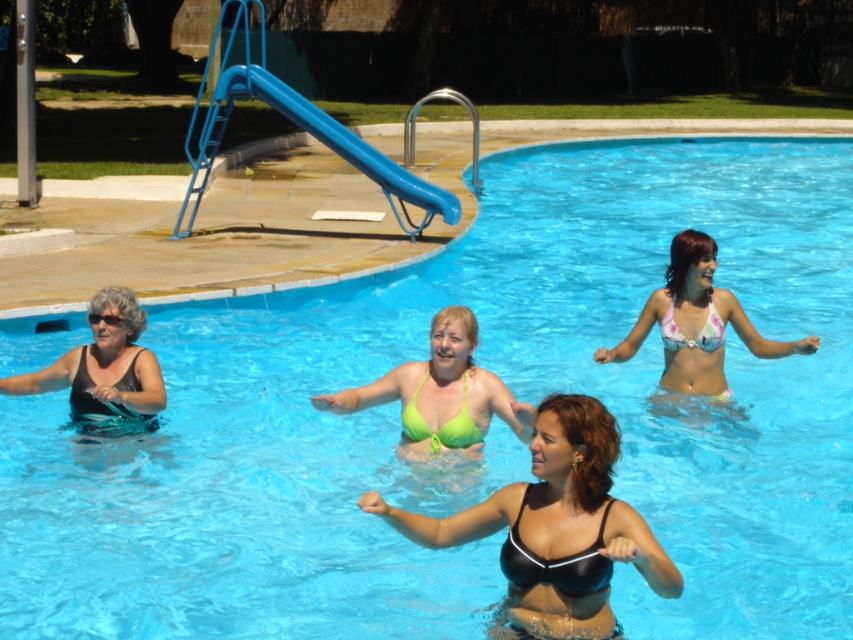
Question: Which of the following is the closest to the observer?

Choices:
 (A) blue plastic slide at upper center
 (B) green bikini top at center
 (C) transparent plastic goggles at lower left
 (D) green matte bikini top at center

Answer: (B)

Question: Does black matte bikini top at center have a larger size compared to green matte bikini top at center?

Choices:
 (A) no
 (B) yes

Answer: (B)

Question: Can you confirm if black matte swimsuit at left is positioned above matte black bikini at left?

Choices:
 (A) no
 (B) yes

Answer: (B)

Question: Which of the following is the closest to the observer?

Choices:
 (A) pink floral bikini top at upper right
 (B) black matte bikini at center
 (C) black matte swimsuit at left

Answer: (B)

Question: Which point is farther from the camera taking this photo?

Choices:
 (A) (664, 346)
 (B) (402, 368)
 (C) (403, 410)
 (D) (91, 321)

Answer: (A)

Question: Is green matte bikini top at center wider than transparent plastic goggles at lower left?

Choices:
 (A) yes
 (B) no

Answer: (A)